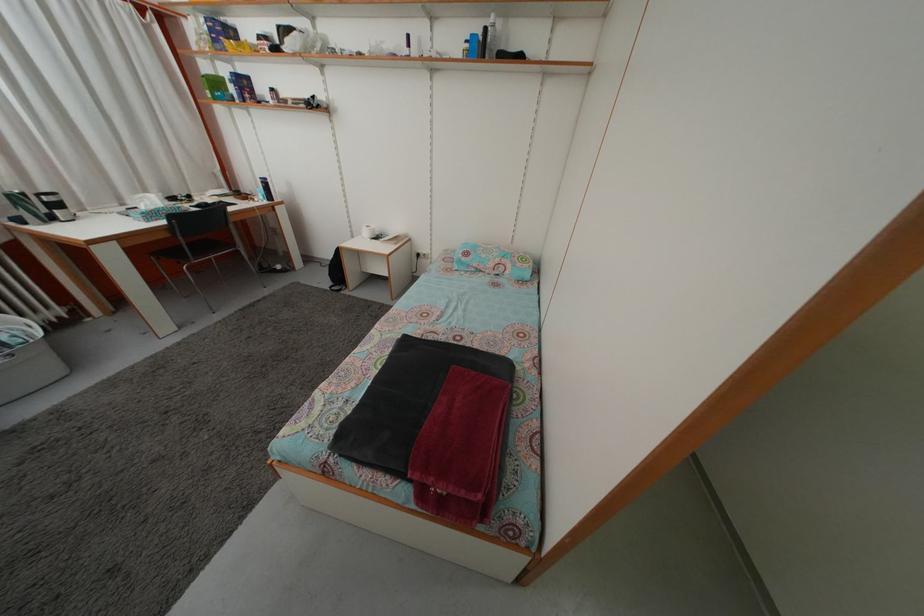
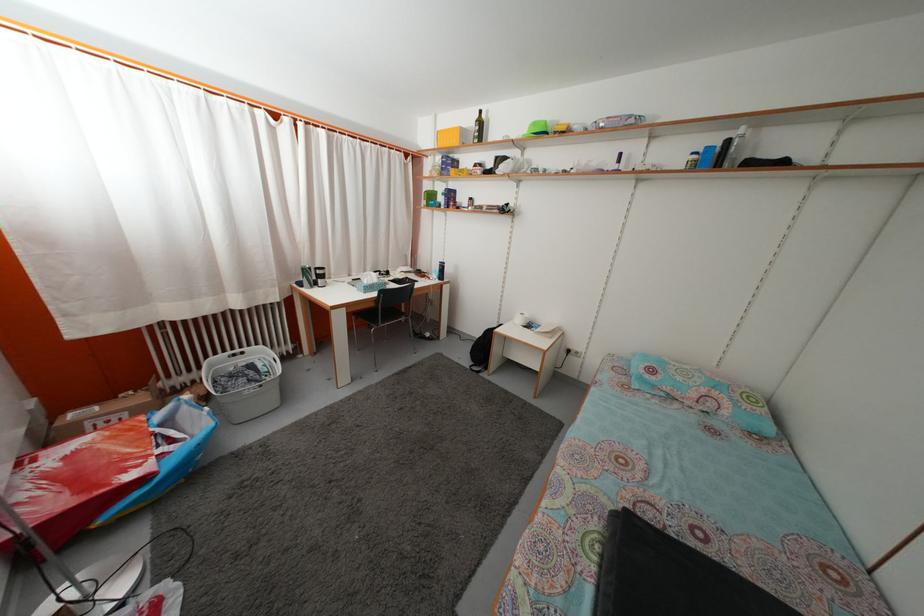
Question: What movement of the cameraman would produce the second image?

Choices:
 (A) Left
 (B) Right
 (C) Forward
 (D) Backward

Answer: (A)